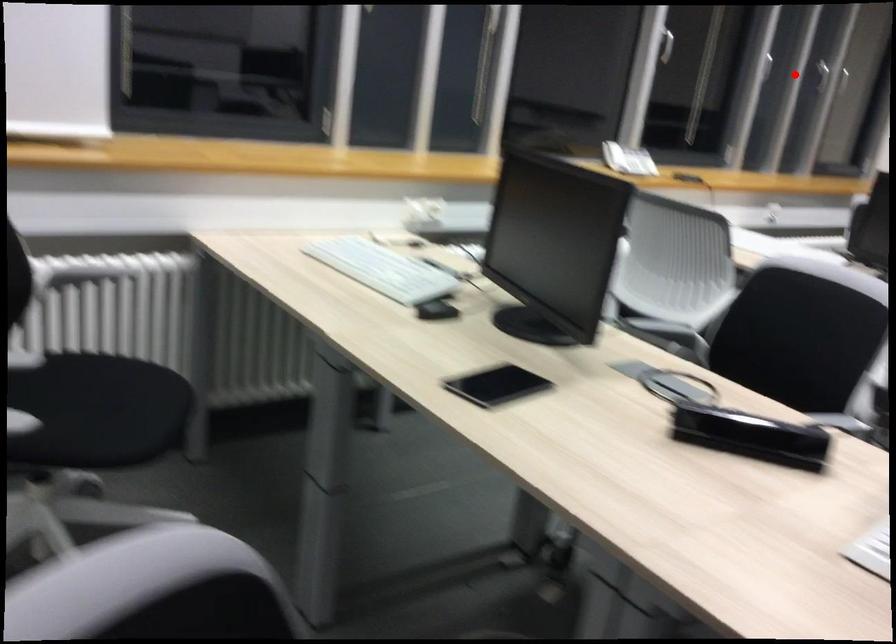
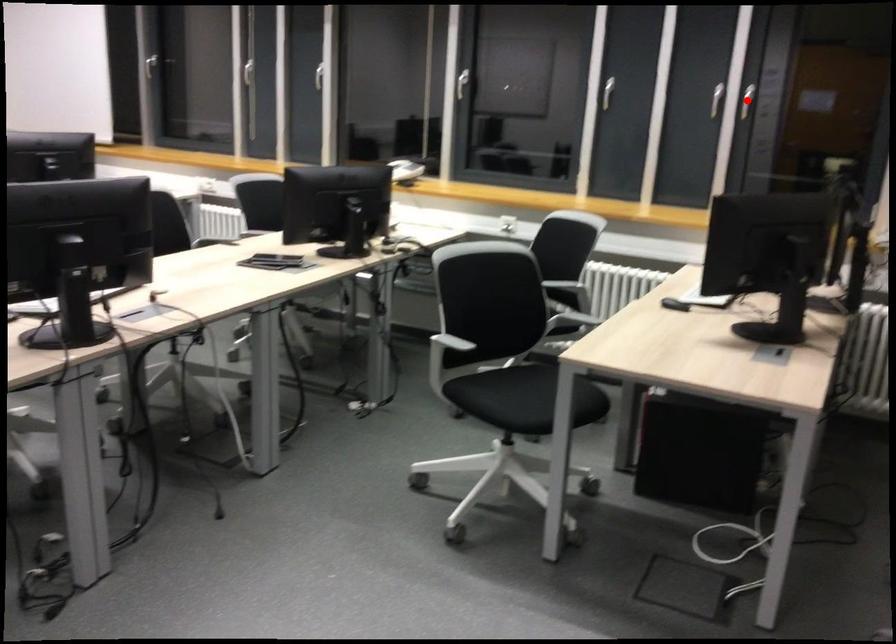
I am providing you with two images of the same scene from different viewpoints. A red point is marked on the first image and another point is marked on the second image. Does the point marked in image1 correspond to the same location as the one in image2?

No